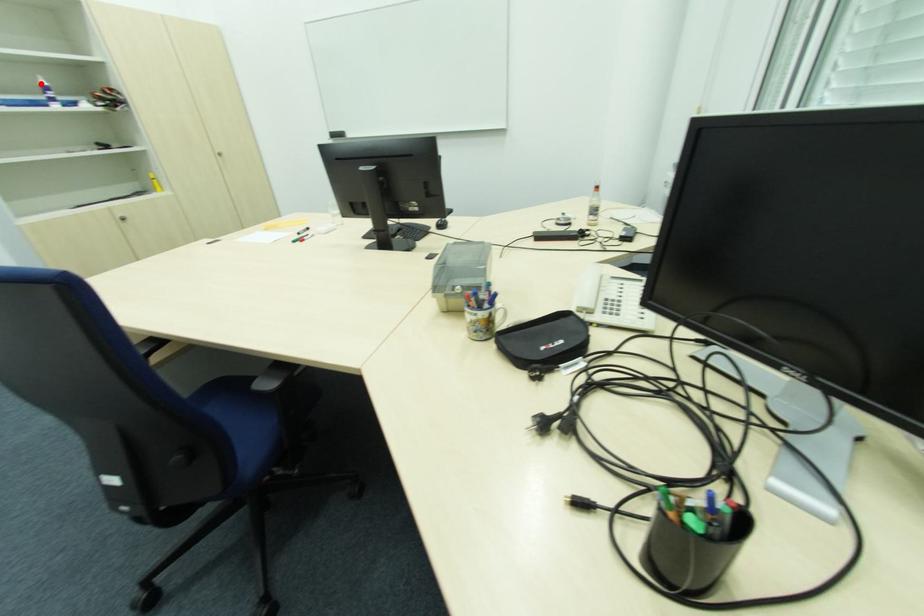
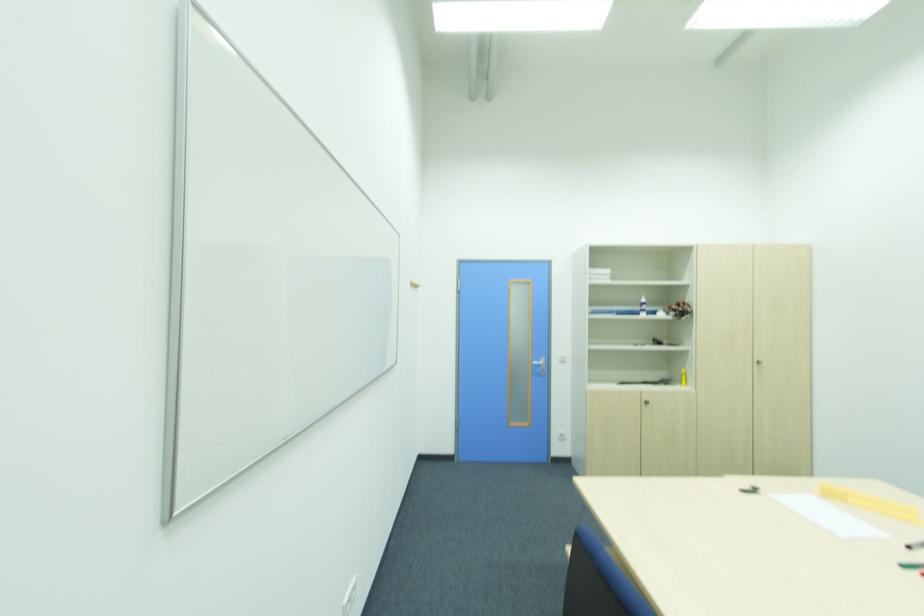
Question: I am providing you with two images of the same scene from different viewpoints. In image1, a red point is highlighted. Considering the same 3D point in image2, which of the following is correct?

Choices:
 (A) It is closer
 (B) It is farther

Answer: (A)